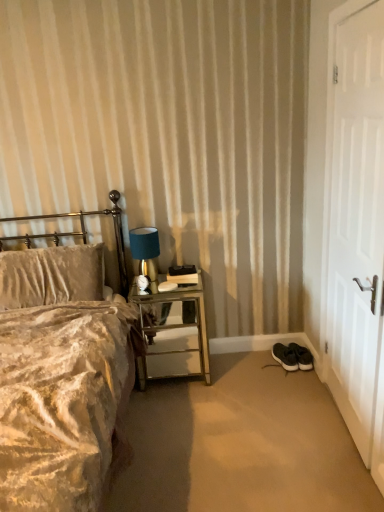
Describe the element at coordinates (145, 251) in the screenshot. I see `satin blue lampshade at upper right` at that location.

This screenshot has height=512, width=384. I want to click on mirrored glass nightstand at center, so click(x=175, y=335).

Measure the distance between black fabric shoes at lower right and camera.

black fabric shoes at lower right is 5.83 feet away from camera.

Find the location of a particular element. metallic gold headboard at left is located at coordinates (83, 233).

Measure the distance between white matte door at right and camera.

white matte door at right and camera are 1.55 meters apart.

The image size is (384, 512). Identify the location of satin blue lampshade at upper right. (145, 251).

Which of these two, black suede sneakers at lower right, the 2th footwear in the right-to-left sequence, or white matte door at right, stands taller?

Standing taller between the two is white matte door at right.

Is black suede sneakers at lower right, marked as the first footwear in a left-to-right arrangement, far away from white matte door at right?

That's right, there is a large distance between black suede sneakers at lower right, marked as the first footwear in a left-to-right arrangement, and white matte door at right.

In terms of size, does black suede sneakers at lower right, marked as the first footwear in a left-to-right arrangement, appear bigger or smaller than white matte door at right?

black suede sneakers at lower right, marked as the first footwear in a left-to-right arrangement, is smaller than white matte door at right.

Is the depth of black suede sneakers at lower right, marked as the first footwear in a left-to-right arrangement, less than that of white matte door at right?

No, black suede sneakers at lower right, marked as the first footwear in a left-to-right arrangement, is further to the viewer.

Is black suede sneakers at lower right, placed as the 1th footwear when sorted from right to left, bigger than velvet beige bed at left?

Incorrect, black suede sneakers at lower right, placed as the 1th footwear when sorted from right to left, is not larger than velvet beige bed at left.

Is black suede sneakers at lower right, placed as the 1th footwear when sorted from right to left, wider or thinner than velvet beige bed at left?

Clearly, black suede sneakers at lower right, placed as the 1th footwear when sorted from right to left, has less width compared to velvet beige bed at left.

From the image's perspective, between black suede sneakers at lower right, placed as the 1th footwear when sorted from right to left, and velvet beige bed at left, who is located below?

black suede sneakers at lower right, placed as the 1th footwear when sorted from right to left, appears lower in the image.

Who is smaller, satin blue lampshade at upper right or black suede sneakers at lower right, marked as the first footwear in a left-to-right arrangement?

Smaller between the two is black suede sneakers at lower right, marked as the first footwear in a left-to-right arrangement.

Based on their positions, is satin blue lampshade at upper right located to the left or right of black suede sneakers at lower right, the 2th footwear in the right-to-left sequence?

From the image, it's evident that satin blue lampshade at upper right is to the left of black suede sneakers at lower right, the 2th footwear in the right-to-left sequence.

Considering the relative sizes of satin blue lampshade at upper right and black suede sneakers at lower right, marked as the first footwear in a left-to-right arrangement, in the image provided, is satin blue lampshade at upper right thinner than black suede sneakers at lower right, marked as the first footwear in a left-to-right arrangement,?

Indeed, satin blue lampshade at upper right has a lesser width compared to black suede sneakers at lower right, marked as the first footwear in a left-to-right arrangement.

Is black suede sneakers at lower right, placed as the 1th footwear when sorted from right to left, wider than white matte door at right?

Correct, the width of black suede sneakers at lower right, placed as the 1th footwear when sorted from right to left, exceeds that of white matte door at right.

Is black suede sneakers at lower right, which is the 2th footwear from left to right, far away from white matte door at right?

Yes, black suede sneakers at lower right, which is the 2th footwear from left to right, and white matte door at right are quite far apart.

Who is more distant, black suede sneakers at lower right, placed as the 1th footwear when sorted from right to left, or white matte door at right?

Positioned behind is black suede sneakers at lower right, placed as the 1th footwear when sorted from right to left.

Which object is positioned more to the left, black suede sneakers at lower right, which is the 2th footwear from left to right, or white matte door at right?

black suede sneakers at lower right, which is the 2th footwear from left to right.

Locate an element on the screen. The height and width of the screenshot is (512, 384). footwear that is the 2nd object located behind the black fabric shoes at lower right is located at coordinates (302, 356).

Can you confirm if black fabric shoes at lower right is wider than black suede sneakers at lower right, which is the 2th footwear from left to right?

Yes, black fabric shoes at lower right is wider than black suede sneakers at lower right, which is the 2th footwear from left to right.

From the image's perspective, is black fabric shoes at lower right over black suede sneakers at lower right, which is the 2th footwear from left to right?

No, from the image's perspective, black fabric shoes at lower right is not over black suede sneakers at lower right, which is the 2th footwear from left to right.

How different are the orientations of black fabric shoes at lower right and black suede sneakers at lower right, which is the 2th footwear from left to right, in degrees?

They differ by 10.7 degrees in their facing directions.

From the image's perspective, would you say mirrored glass nightstand at center is positioned over satin blue lampshade at upper right?

No.

Is mirrored glass nightstand at center not inside satin blue lampshade at upper right?

Absolutely, mirrored glass nightstand at center is external to satin blue lampshade at upper right.

Does mirrored glass nightstand at center have a lesser width compared to satin blue lampshade at upper right?

No.

Does satin blue lampshade at upper right have a greater height compared to white matte door at right?

No.

Does satin blue lampshade at upper right lie in front of white matte door at right?

No, satin blue lampshade at upper right is further to the viewer.

From a real-world perspective, which object rests below the other?

In real-world perspective, satin blue lampshade at upper right is lower.

From the image's perspective, starting from the white matte door at right, which footwear is the 2nd one below? Please provide its 2D coordinates.

[(285, 357)]

The image size is (384, 512). I want to click on bed above the black suede sneakers at lower right, placed as the 1th footwear when sorted from right to left (from a real-world perspective), so pyautogui.click(x=63, y=401).

In the scene shown: Which object lies nearer to the anchor point black suede sneakers at lower right, placed as the 1th footwear when sorted from right to left, velvet beige bed at left or metallic gold headboard at left?

metallic gold headboard at left lies closer to black suede sneakers at lower right, placed as the 1th footwear when sorted from right to left, than the other object.

In the scene shown: Estimate the real-world distances between objects in this image. Which object is further from satin blue lampshade at upper right, black suede sneakers at lower right, placed as the 1th footwear when sorted from right to left, or black fabric shoes at lower right?

black suede sneakers at lower right, placed as the 1th footwear when sorted from right to left, is positioned further to the anchor satin blue lampshade at upper right.

Looking at the image, which one is located further to black suede sneakers at lower right, which is the 2th footwear from left to right, black suede sneakers at lower right, the 2th footwear in the right-to-left sequence, or mirrored glass nightstand at center?

The object further to black suede sneakers at lower right, which is the 2th footwear from left to right, is mirrored glass nightstand at center.

Looking at the image, which one is located closer to black suede sneakers at lower right, which is the 2th footwear from left to right, mirrored glass nightstand at center or black fabric shoes at lower right?

Based on the image, black fabric shoes at lower right appears to be nearer to black suede sneakers at lower right, which is the 2th footwear from left to right.

Looking at the image, which one is located further to metallic gold headboard at left, white matte door at right or mirrored glass nightstand at center?

white matte door at right.

Based on their spatial positions, is black fabric shoes at lower right or black suede sneakers at lower right, placed as the 1th footwear when sorted from right to left, further from satin blue lampshade at upper right?

Among the two, black suede sneakers at lower right, placed as the 1th footwear when sorted from right to left, is located further to satin blue lampshade at upper right.

Looking at the image, which one is located further to satin blue lampshade at upper right, metallic gold headboard at left or white matte door at right?

white matte door at right.

From the image, which object appears to be farther from metallic gold headboard at left, satin blue lampshade at upper right or black suede sneakers at lower right, the 2th footwear in the right-to-left sequence?

black suede sneakers at lower right, the 2th footwear in the right-to-left sequence, lies further to metallic gold headboard at left than the other object.

Where is `nightstand between white matte door at right and black suede sneakers at lower right, which is the 2th footwear from left to right, from front to back`? nightstand between white matte door at right and black suede sneakers at lower right, which is the 2th footwear from left to right, from front to back is located at coordinates (175, 335).

Locate an element on the screen. nightstand between satin blue lampshade at upper right and black suede sneakers at lower right, the 2th footwear in the right-to-left sequence is located at coordinates (175, 335).

Where is `plain situated between satin blue lampshade at upper right and black suede sneakers at lower right, placed as the 1th footwear when sorted from right to left, from left to right`? The width and height of the screenshot is (384, 512). plain situated between satin blue lampshade at upper right and black suede sneakers at lower right, placed as the 1th footwear when sorted from right to left, from left to right is located at coordinates (241, 445).

Locate an element on the screen. The height and width of the screenshot is (512, 384). nightstand between metallic gold headboard at left and black suede sneakers at lower right, placed as the 1th footwear when sorted from right to left, from left to right is located at coordinates (175, 335).